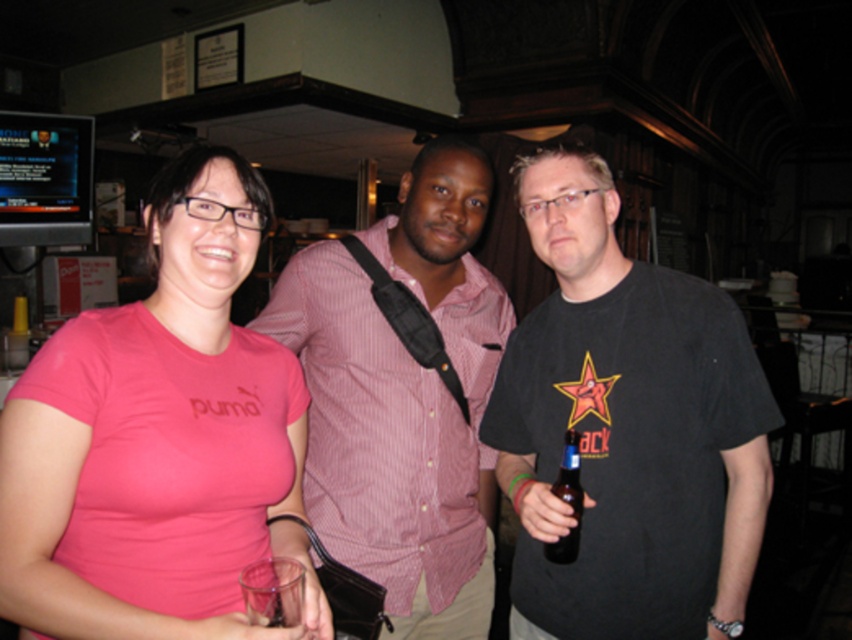
You are standing in a bar and want to order a drink from the bartender. The bartender is at point (x=390, y=515). You are 5.12 feet away from them. Can you reach the bartender to order your drink without moving closer?

The distance between you and the bartender at point (x=390, y=515) is 5.12 feet. Since this distance is typical for social interactions in a bar setting, you can comfortably reach the bartender to order your drink without needing to move closer.

You are at a party and need to grab a drink from the table next to the pink striped shirt at center and the clear plastic bottle at left. Which one should you approach first to get the drink?

The clear plastic bottle at left is to the left of the pink striped shirt at center, so you should approach the clear plastic bottle at left first to get the drink since it is closer to your current position.

You are at a bar and want to grab your drink. Where is the transparent plastic cup at lower left located?

The transparent plastic cup at lower left is located at point (273, 592).